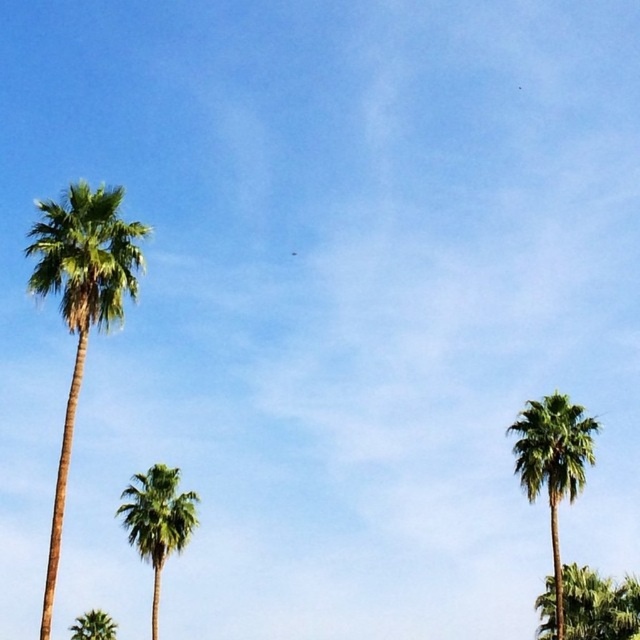
Identify the location of green leafy palm at center. (157, 520).

Can you confirm if green leafy palm at center is thinner than green leafy palm at lower right?

Indeed, green leafy palm at center has a lesser width compared to green leafy palm at lower right.

Measure the distance between green leafy palm at center and camera.

A distance of 46.48 meters exists between green leafy palm at center and camera.

Find the location of a particular element. Image resolution: width=640 pixels, height=640 pixels. green leafy palm at center is located at coordinates 157,520.

Can you confirm if green leafy palm tree at right is positioned above green leafy palm at lower right?

Yes, green leafy palm tree at right is above green leafy palm at lower right.

What are the coordinates of `green leafy palm tree at right` in the screenshot? It's located at (554, 465).

Who is higher up, green leafy palm tree at right or green leafy palm tree at lower left?

green leafy palm tree at right is above.

Can you confirm if green leafy palm tree at right is thinner than green leafy palm tree at lower left?

Indeed, green leafy palm tree at right has a lesser width compared to green leafy palm tree at lower left.

Is point (522, 470) positioned in front of point (115, 621)?

Yes, point (522, 470) is closer to viewer.

Image resolution: width=640 pixels, height=640 pixels. Identify the location of green leafy palm tree at right. (554, 465).